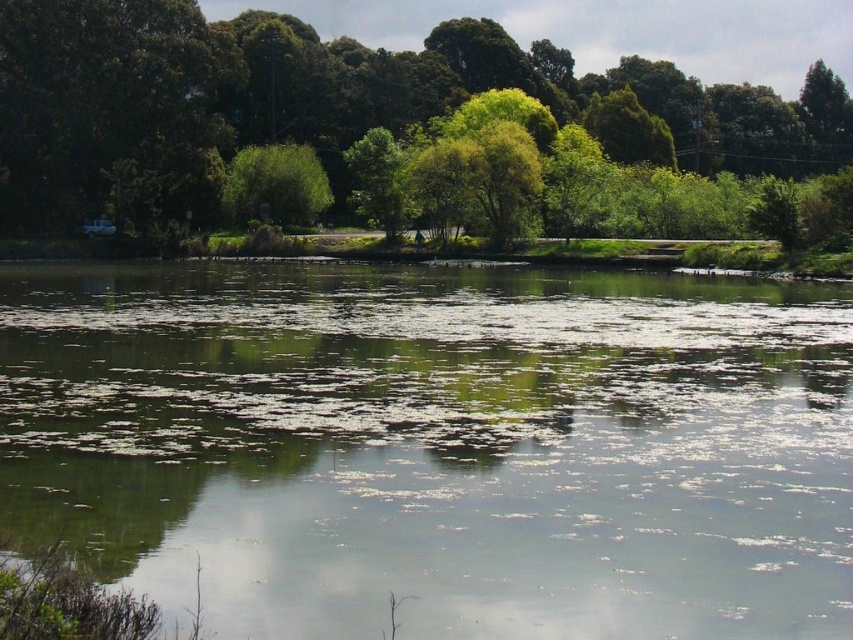
Does green leafy tree at upper center come in front of green leafy tree at center?

Yes, it is.

Is point (0, 109) closer to camera compared to point (280, 157)?

Yes, it is in front of point (280, 157).

Which is in front, point (814, 74) or point (296, 209)?

Positioned in front is point (296, 209).

Identify the location of green leafy tree at upper center. (329, 102).

Is point (115, 545) positioned before point (228, 192)?

Yes, it is in front of point (228, 192).

The height and width of the screenshot is (640, 853). In order to click on green algae at center in this screenshot , I will do `click(437, 445)`.

Which is more to the right, green algae at center or green leafy tree at upper center?

From the viewer's perspective, green leafy tree at upper center appears more on the right side.

Who is higher up, green algae at center or green leafy tree at upper center?

green leafy tree at upper center

Find the location of a particular element. The image size is (853, 640). green algae at center is located at coordinates coord(437,445).